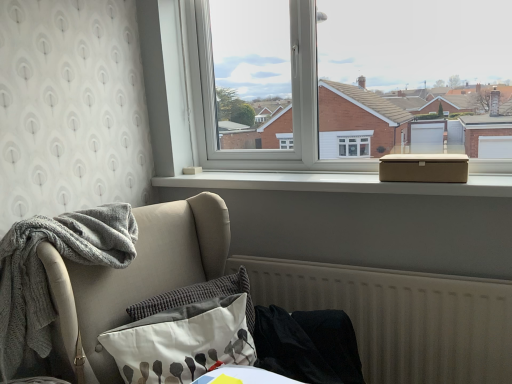
Question: Is gray knitted blanket at left, arranged as the 1th material when viewed from the left, wider or thinner than black fabric at lower right, arranged as the first material when viewed from the right?

Choices:
 (A) wide
 (B) thin

Answer: (A)

Question: Is point (134, 251) positioned closer to the camera than point (338, 380)?

Choices:
 (A) closer
 (B) farther

Answer: (B)

Question: Which object is the closest to the white smooth window sill at upper center?

Choices:
 (A) beige textured radiator at lower right
 (B) textured gray pillow at lower left, which is the 2th pillow from back to front
 (C) textured gray pillow at lower center, marked as the second pillow in a front-to-back arrangement
 (D) black fabric at lower right, the 2th material positioned from the left
 (E) gray knitted blanket at left, arranged as the 1th material when viewed from the left

Answer: (A)

Question: Which of these objects is positioned closest to the black fabric at lower right, arranged as the first material when viewed from the right?

Choices:
 (A) textured gray pillow at lower left, which is the 2th pillow from back to front
 (B) white smooth window sill at upper center
 (C) brown cardboard box at upper right
 (D) gray knitted blanket at left, arranged as the 1th material when viewed from the left
 (E) textured gray pillow at lower center, marked as the second pillow in a front-to-back arrangement

Answer: (E)